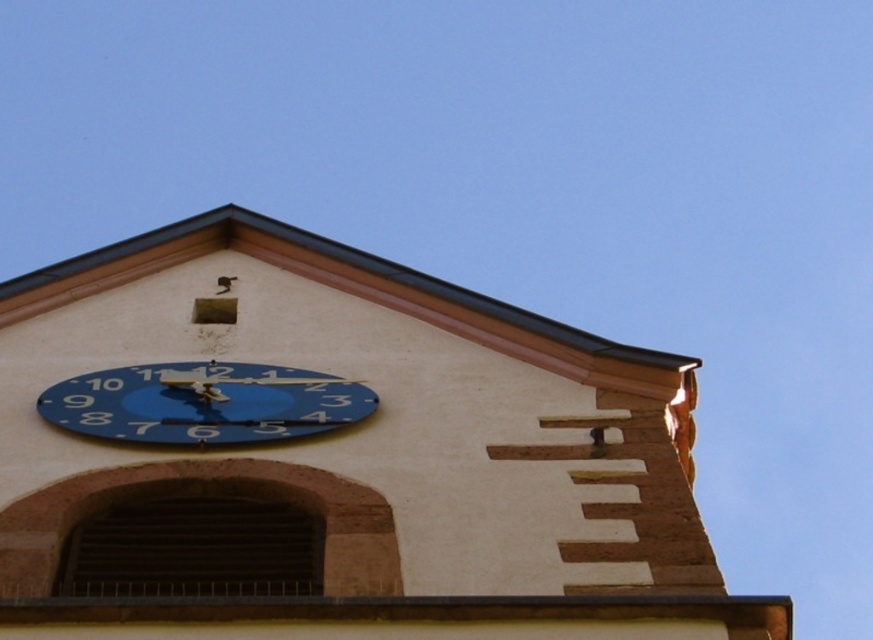
Question: Does blue painted clock face at upper center have a larger size compared to blue painted clock face at center?

Choices:
 (A) yes
 (B) no

Answer: (A)

Question: Does blue painted clock face at upper center appear under blue painted clock face at center?

Choices:
 (A) no
 (B) yes

Answer: (B)

Question: Among these points, which one is nearest to the camera?

Choices:
 (A) (83, 374)
 (B) (38, 330)

Answer: (A)

Question: Which of the following is the farthest from the observer?

Choices:
 (A) (622, 605)
 (B) (330, 419)

Answer: (B)

Question: Which object appears farthest from the camera in this image?

Choices:
 (A) blue painted clock face at center
 (B) blue painted clock face at upper center

Answer: (A)

Question: Does blue painted clock face at upper center have a smaller size compared to blue painted clock face at center?

Choices:
 (A) yes
 (B) no

Answer: (B)